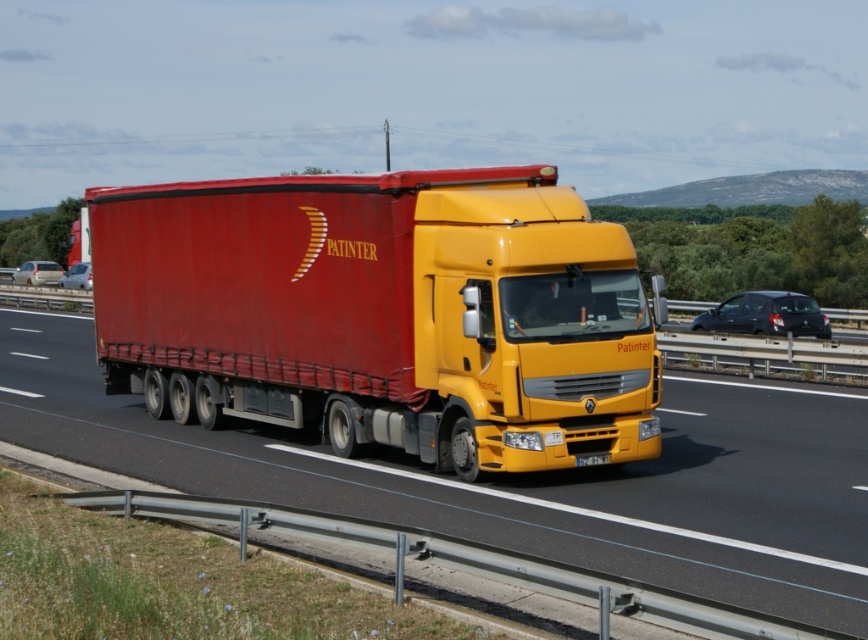
Which is in front, point (435, 332) or point (577, 465)?

Point (577, 465) is in front.

Is matte red trailer truck at center shorter than yellow matte license plate at center?

No.

Does point (569, 337) lie in front of point (587, 456)?

Yes.

What are the coordinates of `matte red trailer truck at center` in the screenshot? It's located at (382, 314).

Is yellow matte truck at center wider than metallic silver sedan at left?

Yes.

Does yellow matte truck at center have a lesser height compared to metallic silver sedan at left?

Correct, yellow matte truck at center is not as tall as metallic silver sedan at left.

Where is `yellow matte truck at center`? The height and width of the screenshot is (640, 868). yellow matte truck at center is located at coordinates (520, 477).

What do you see at coordinates (765, 316) in the screenshot?
I see `matte black car at right` at bounding box center [765, 316].

Which is below, matte black car at right or yellow matte license plate at center?

yellow matte license plate at center is below.

Who is more distant from viewer, (814, 307) or (600, 458)?

Point (814, 307)

Find the location of a particular element. The width and height of the screenshot is (868, 640). matte black car at right is located at coordinates (765, 316).